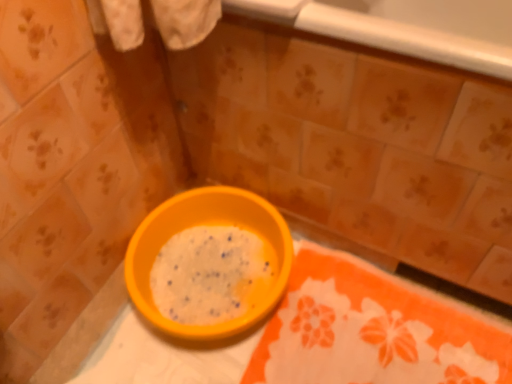
Locate an element on the screen. orange plastic bowl at center is located at coordinates (209, 224).

Describe the element at coordinates (209, 224) in the screenshot. Image resolution: width=512 pixels, height=384 pixels. I see `orange plastic bowl at center` at that location.

What is the approximate width of orange fabric tablecloth at lower right?

14.57 inches.

The image size is (512, 384). What do you see at coordinates (372, 331) in the screenshot?
I see `orange fabric tablecloth at lower right` at bounding box center [372, 331].

Locate an element on the screen. orange fabric tablecloth at lower right is located at coordinates (372, 331).

From the picture: In order to face orange fabric tablecloth at lower right, should I rotate leftwards or rightwards?

Turn right by 15.840 degrees to look at orange fabric tablecloth at lower right.

You are a GUI agent. You are given a task and a screenshot of the screen. Output one action in this format:
    pyautogui.click(x=<x>, y=<y>)
    Task: Click on the orange plastic bowl at center
    This screenshot has height=384, width=512.
    Given the screenshot: What is the action you would take?
    pyautogui.click(x=209, y=224)

Considering the positions of objects orange fabric tablecloth at lower right and orange plastic bowl at center in the image provided, who is more to the right, orange fabric tablecloth at lower right or orange plastic bowl at center?

Positioned to the right is orange fabric tablecloth at lower right.

Is orange fabric tablecloth at lower right closer to the viewer compared to orange plastic bowl at center?

Yes, it is.

Is point (265, 329) closer to viewer compared to point (189, 330)?

No, (265, 329) is behind (189, 330).

Consider the image. From the image's perspective, is orange fabric tablecloth at lower right above orange plastic bowl at center?

No, from the image's perspective, orange fabric tablecloth at lower right is not over orange plastic bowl at center.

Looking at this image, from a real-world perspective, is orange fabric tablecloth at lower right over orange plastic bowl at center?

No.

Considering the relative sizes of orange fabric tablecloth at lower right and orange plastic bowl at center in the image provided, is orange fabric tablecloth at lower right wider than orange plastic bowl at center?

Correct, the width of orange fabric tablecloth at lower right exceeds that of orange plastic bowl at center.

Is orange fabric tablecloth at lower right taller or shorter than orange plastic bowl at center?

Considering their sizes, orange fabric tablecloth at lower right has less height than orange plastic bowl at center.

Considering the sizes of objects orange fabric tablecloth at lower right and orange plastic bowl at center in the image provided, who is bigger, orange fabric tablecloth at lower right or orange plastic bowl at center?

orange plastic bowl at center.

Does orange fabric tablecloth at lower right contain orange plastic bowl at center?

No, orange fabric tablecloth at lower right does not contain orange plastic bowl at center.

Is orange fabric tablecloth at lower right touching orange plastic bowl at center?

orange fabric tablecloth at lower right and orange plastic bowl at center are clearly separated.

Is orange fabric tablecloth at lower right facing towards orange plastic bowl at center?

No, orange fabric tablecloth at lower right is not turned towards orange plastic bowl at center.

Measure the distance between orange fabric tablecloth at lower right and orange plastic bowl at center.

8.79 inches.

Where is `bowl that appears above the orange fabric tablecloth at lower right (from a real-world perspective)`? bowl that appears above the orange fabric tablecloth at lower right (from a real-world perspective) is located at coordinates (209, 224).

Which is more to the left, orange plastic bowl at center or orange fabric tablecloth at lower right?

Positioned to the left is orange plastic bowl at center.

Is the depth of orange plastic bowl at center less than that of orange fabric tablecloth at lower right?

No, orange plastic bowl at center is behind orange fabric tablecloth at lower right.

Is point (253, 228) positioned in front of point (361, 304)?

That is False.

From the image's perspective, which is below, orange plastic bowl at center or orange fabric tablecloth at lower right?

orange fabric tablecloth at lower right is shown below in the image.

From a real-world perspective, which object stands above the other?

From a 3D spatial view, orange plastic bowl at center is above.

Is orange plastic bowl at center wider or thinner than orange fabric tablecloth at lower right?

Clearly, orange plastic bowl at center has less width compared to orange fabric tablecloth at lower right.

Considering the sizes of orange plastic bowl at center and orange fabric tablecloth at lower right in the image, is orange plastic bowl at center taller or shorter than orange fabric tablecloth at lower right?

In the image, orange plastic bowl at center appears to be taller than orange fabric tablecloth at lower right.

Considering the sizes of objects orange plastic bowl at center and orange fabric tablecloth at lower right in the image provided, who is bigger, orange plastic bowl at center or orange fabric tablecloth at lower right?

orange plastic bowl at center.

Is orange fabric tablecloth at lower right surrounded by orange plastic bowl at center?

No, orange fabric tablecloth at lower right is not a part of orange plastic bowl at center.

Would you consider orange plastic bowl at center to be distant from orange fabric tablecloth at lower right?

No, orange plastic bowl at center is not far from orange fabric tablecloth at lower right.

Is orange fabric tablecloth at lower right at the back of orange plastic bowl at center?

orange plastic bowl at center is not turned away from orange fabric tablecloth at lower right.

How different are the orientations of orange plastic bowl at center and orange fabric tablecloth at lower right in degrees?

91 degrees.

How far apart are orange plastic bowl at center and orange fabric tablecloth at lower right?

A distance of 8.79 inches exists between orange plastic bowl at center and orange fabric tablecloth at lower right.

Identify the location of bowl above the orange fabric tablecloth at lower right (from the image's perspective). (209, 224).

At what (x,y) coordinates should I click in order to perform the action: click on tablecloth located on the right of orange plastic bowl at center. Please return your answer as a coordinate pair (x, y). The image size is (512, 384). Looking at the image, I should click on (372, 331).

Where is `bowl above the orange fabric tablecloth at lower right (from a real-world perspective)`? This screenshot has height=384, width=512. bowl above the orange fabric tablecloth at lower right (from a real-world perspective) is located at coordinates (209, 224).